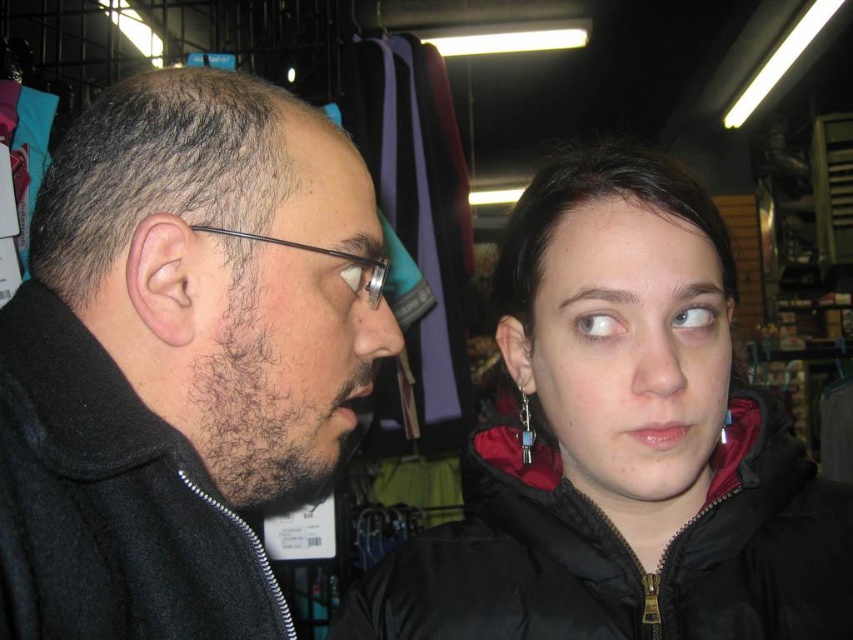
Where is the black matte jacket at left located in the image?

The black matte jacket at left is located at point [181,356].